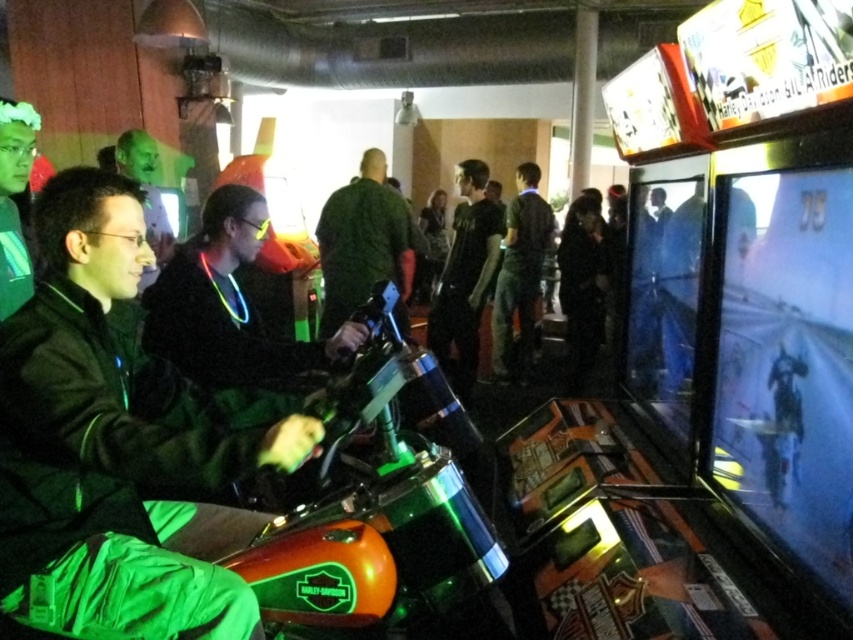
Question: Considering the real-world distances, which object is closest to the black matte jacket at center?

Choices:
 (A) green matte jacket at center
 (B) green matte shirt at center

Answer: (A)

Question: Is black cotton shirt at center closer to camera compared to dark green shirt at center?

Choices:
 (A) yes
 (B) no

Answer: (A)

Question: Which point is farther from the camera taking this photo?

Choices:
 (A) (515, 243)
 (B) (177, 328)

Answer: (A)

Question: Which of the following is the closest to the observer?

Choices:
 (A) (508, 371)
 (B) (18, 323)
 (C) (439, 364)
 (D) (392, 257)

Answer: (B)

Question: In this image, where is green matte jacket at center located relative to black cotton shirt at center?

Choices:
 (A) below
 (B) above

Answer: (A)

Question: Is green matte jacket at center positioned behind green matte shirt at center?

Choices:
 (A) yes
 (B) no

Answer: (B)